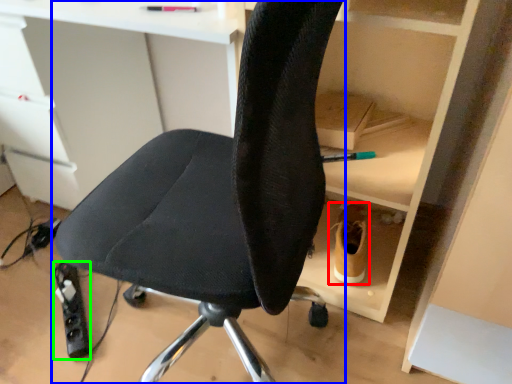
Question: Which object is the farthest from footwear (highlighted by a red box)? Choose among these: chair (highlighted by a blue box) or equipment (highlighted by a green box).

Choices:
 (A) chair
 (B) equipment

Answer: (B)